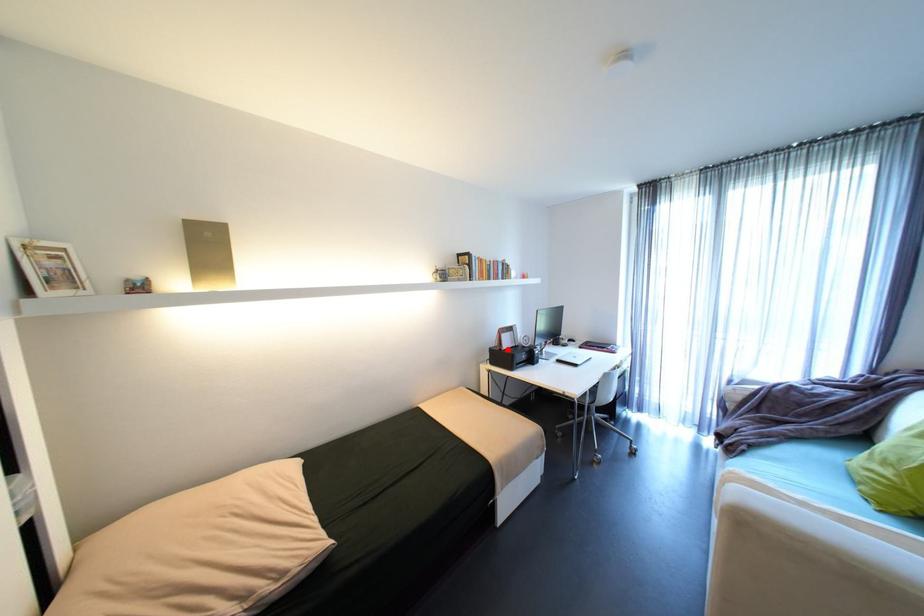
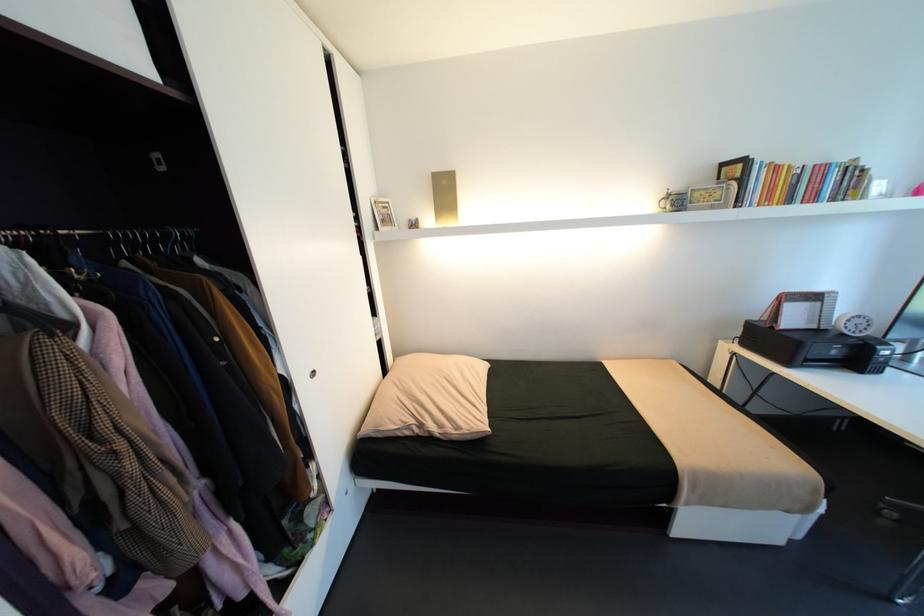
In the second image, find the point that corresponds to the highlighted location in the first image.

(779, 328)